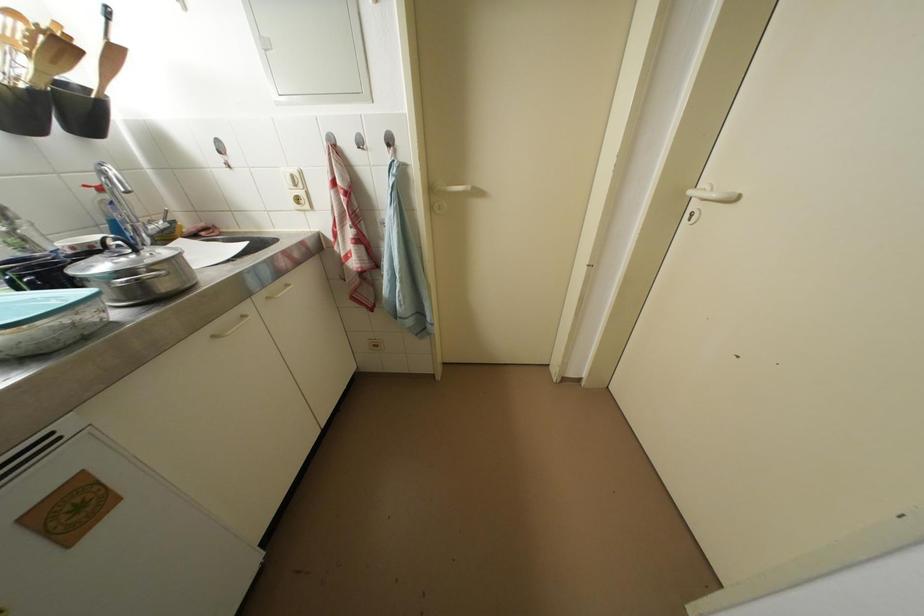
Find where to lift the glass container with lid. Please return your answer as a coordinate pair (x, y).

(47, 320)